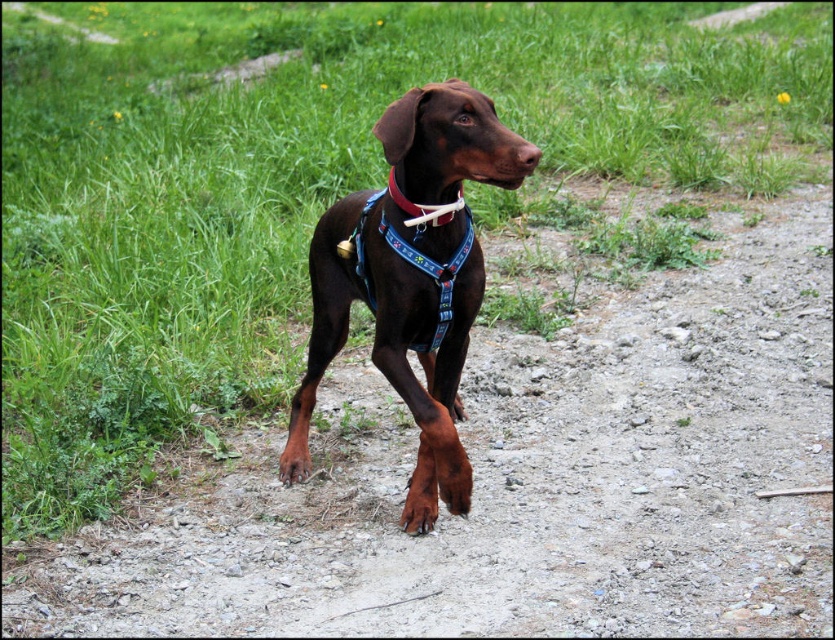
You are standing on the gravel path and looking at the two points marked in the image. Which point, point (x=408, y=92) or point (x=393, y=186), is closer to you?

Point (x=408, y=92) is closer to the viewer than point (x=393, y=186).

From the picture: You are standing in front of the Doberman Pinscher on the gravel path. There are two points marked in the scene. The first point is at coordinates point (740, 604) and the second is at point (429, 209). Which of these points is closer to you?

Point (740, 604) is closer to the viewer than point (429, 209).